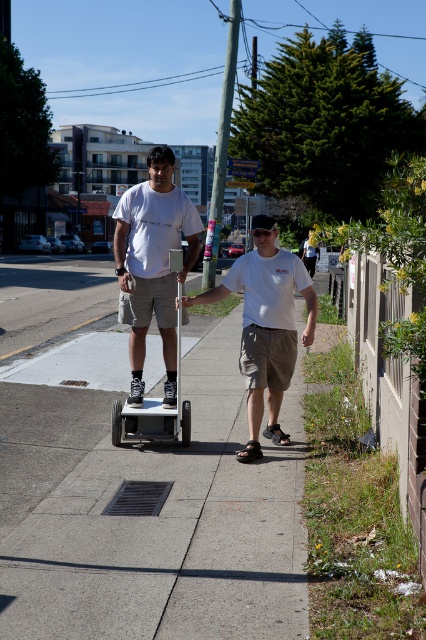
Question: Is white matte shirt at center bigger than metallic silver scooter at center?

Choices:
 (A) no
 (B) yes

Answer: (A)

Question: Can you confirm if white matte shirt at center is positioned to the left of metallic silver scooter at center?

Choices:
 (A) yes
 (B) no

Answer: (B)

Question: Among these objects, which one is nearest to the camera?

Choices:
 (A) matte white shirt at center
 (B) metallic silver scooter at center
 (C) white matte shirt at center

Answer: (A)

Question: Does matte white shirt at center appear on the left side of white matte shirt at center?

Choices:
 (A) yes
 (B) no

Answer: (A)

Question: Which of the following is the closest to the observer?

Choices:
 (A) (117, 428)
 (B) (242, 259)

Answer: (B)

Question: Estimate the real-world distances between objects in this image. Which object is farther from the white matte shirt at center?

Choices:
 (A) metallic silver scooter at center
 (B) matte white shirt at center

Answer: (A)